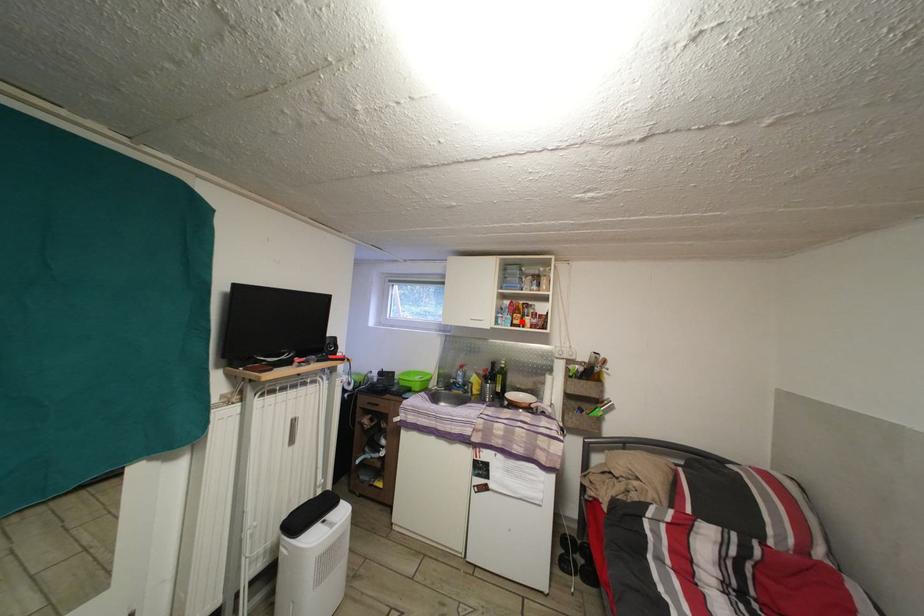
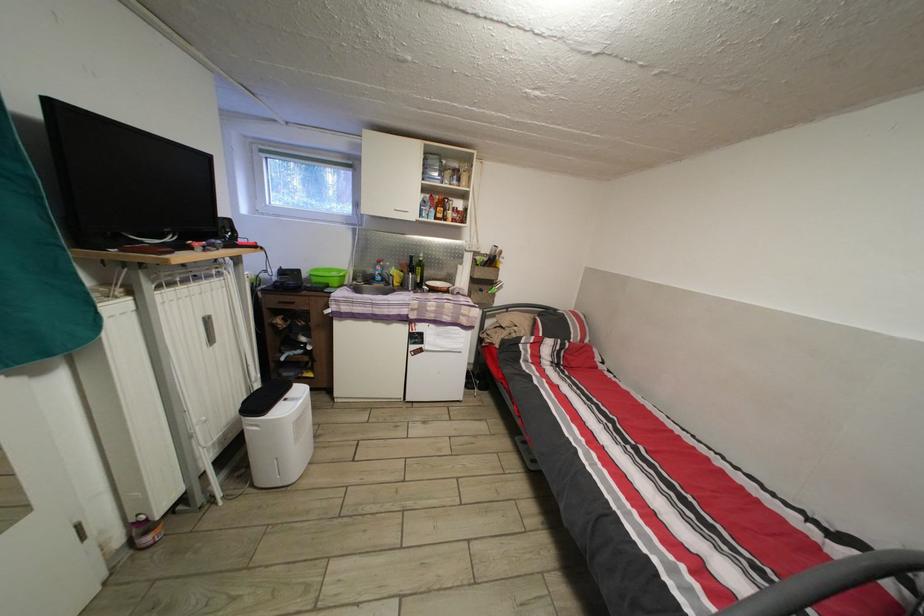
Where in the second image is the point corresponding to the highlighted location from the first image?

(445, 215)